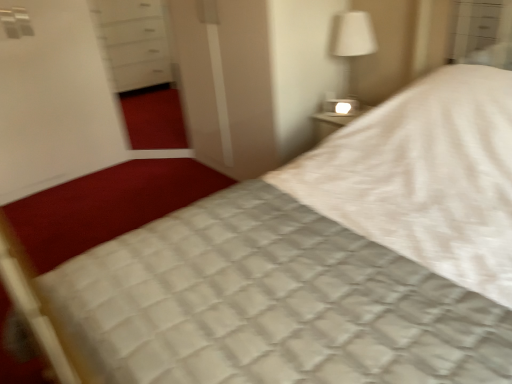
Image resolution: width=512 pixels, height=384 pixels. Describe the element at coordinates (226, 83) in the screenshot. I see `transparent glass screen door at center, which is the first screen door in right-to-left order` at that location.

I want to click on transparent glass screen door at center, which is the first screen door in right-to-left order, so click(x=226, y=83).

Considering the positions of objects white glossy screen door at upper left, the 1th screen door from the left, and transparent glass screen door at center, which is the first screen door in right-to-left order, in the image provided, who is behind, white glossy screen door at upper left, the 1th screen door from the left, or transparent glass screen door at center, which is the first screen door in right-to-left order,?

white glossy screen door at upper left, the 1th screen door from the left, is further from the camera.

From a real-world perspective, is white glossy screen door at upper left, the 1th screen door from the left, positioned over transparent glass screen door at center, which is the first screen door in right-to-left order, based on gravity?

Indeed, from a real-world perspective, white glossy screen door at upper left, the 1th screen door from the left, stands above transparent glass screen door at center, which is the first screen door in right-to-left order.

Can you confirm if white glossy screen door at upper left, marked as the 2th screen door in a right-to-left arrangement, is positioned to the left of transparent glass screen door at center, which is the first screen door in right-to-left order?

Indeed, white glossy screen door at upper left, marked as the 2th screen door in a right-to-left arrangement, is positioned on the left side of transparent glass screen door at center, which is the first screen door in right-to-left order.

This screenshot has width=512, height=384. In the image, there is a white glossy screen door at upper left, marked as the 2th screen door in a right-to-left arrangement. In order to click on screen door below it (from a real-world perspective) in this screenshot , I will do `click(226, 83)`.

Considering the points (72, 31) and (347, 52), which point is behind, point (72, 31) or point (347, 52)?

The point (72, 31) is farther from the camera.

Between white glossy screen door at upper left, marked as the 2th screen door in a right-to-left arrangement, and white fabric lampshade at upper right, which one has larger width?

With larger width is white glossy screen door at upper left, marked as the 2th screen door in a right-to-left arrangement.

From their relative heights in the image, would you say white glossy screen door at upper left, the 1th screen door from the left, is taller or shorter than white fabric lampshade at upper right?

Clearly, white glossy screen door at upper left, the 1th screen door from the left, is taller compared to white fabric lampshade at upper right.

In the scene shown: Between transparent glass screen door at center, the 2th screen door from the left, and white fabric lampshade at upper right, which one is positioned behind?

white fabric lampshade at upper right is further away from the camera.

Can you confirm if transparent glass screen door at center, which is the first screen door in right-to-left order, is taller than white fabric lampshade at upper right?

Indeed, transparent glass screen door at center, which is the first screen door in right-to-left order, has a greater height compared to white fabric lampshade at upper right.

Which object is positioned more to the left, transparent glass screen door at center, the 2th screen door from the left, or white fabric lampshade at upper right?

Positioned to the left is transparent glass screen door at center, the 2th screen door from the left.

Is point (263, 108) positioned after point (362, 41)?

Yes, point (263, 108) is farther from viewer.

From their relative heights in the image, would you say white fabric lampshade at upper right is taller or shorter than transparent glass screen door at center, which is the first screen door in right-to-left order?

Clearly, white fabric lampshade at upper right is shorter compared to transparent glass screen door at center, which is the first screen door in right-to-left order.

Which of these two, white fabric lampshade at upper right or transparent glass screen door at center, which is the first screen door in right-to-left order, is wider?

With larger width is transparent glass screen door at center, which is the first screen door in right-to-left order.

Is white fabric lampshade at upper right far away from transparent glass screen door at center, the 2th screen door from the left?

white fabric lampshade at upper right is near transparent glass screen door at center, the 2th screen door from the left, not far away.

From a real-world perspective, between transparent glass screen door at center, which is the first screen door in right-to-left order, and white glossy screen door at upper left, marked as the 2th screen door in a right-to-left arrangement, who is vertically higher?

white glossy screen door at upper left, marked as the 2th screen door in a right-to-left arrangement, is physically above.

From the picture: Which of these two, transparent glass screen door at center, the 2th screen door from the left, or white glossy screen door at upper left, the 1th screen door from the left, stands taller?

Standing taller between the two is white glossy screen door at upper left, the 1th screen door from the left.

Is transparent glass screen door at center, which is the first screen door in right-to-left order, in front of white glossy screen door at upper left, marked as the 2th screen door in a right-to-left arrangement?

Yes, transparent glass screen door at center, which is the first screen door in right-to-left order, is closer to the camera.

Considering the positions of objects transparent glass screen door at center, which is the first screen door in right-to-left order, and white glossy screen door at upper left, the 1th screen door from the left, in the image provided, who is more to the right, transparent glass screen door at center, which is the first screen door in right-to-left order, or white glossy screen door at upper left, the 1th screen door from the left,?

transparent glass screen door at center, which is the first screen door in right-to-left order, is more to the right.

Are white fabric lampshade at upper right and white glossy screen door at upper left, the 1th screen door from the left, making contact?

No, white fabric lampshade at upper right is not in contact with white glossy screen door at upper left, the 1th screen door from the left.

Looking at this image, how many degrees apart are the facing directions of white fabric lampshade at upper right and white glossy screen door at upper left, the 1th screen door from the left?

92.1 degrees.

Does white fabric lampshade at upper right have a larger size compared to white glossy screen door at upper left, marked as the 2th screen door in a right-to-left arrangement?

No.

Is white fabric lampshade at upper right looking in the opposite direction of white glossy screen door at upper left, marked as the 2th screen door in a right-to-left arrangement?

No, white fabric lampshade at upper right is not facing the opposite direction of white glossy screen door at upper left, marked as the 2th screen door in a right-to-left arrangement.

This screenshot has width=512, height=384. I want to click on screen door to the left of transparent glass screen door at center, the 2th screen door from the left, so click(55, 101).

Where is `bedside lamp located above the white glossy screen door at upper left, the 1th screen door from the left (from a real-world perspective)`? The width and height of the screenshot is (512, 384). bedside lamp located above the white glossy screen door at upper left, the 1th screen door from the left (from a real-world perspective) is located at coordinates (353, 42).

From the image, which object appears to be nearer to transparent glass screen door at center, which is the first screen door in right-to-left order, white fabric lampshade at upper right or white glossy screen door at upper left, marked as the 2th screen door in a right-to-left arrangement?

white fabric lampshade at upper right.

Looking at the image, which one is located closer to white fabric lampshade at upper right, white glossy screen door at upper left, the 1th screen door from the left, or transparent glass screen door at center, the 2th screen door from the left?

transparent glass screen door at center, the 2th screen door from the left, lies closer to white fabric lampshade at upper right than the other object.

Which object lies nearer to the anchor point white glossy screen door at upper left, the 1th screen door from the left, white fabric lampshade at upper right or transparent glass screen door at center, which is the first screen door in right-to-left order?

transparent glass screen door at center, which is the first screen door in right-to-left order, lies closer to white glossy screen door at upper left, the 1th screen door from the left, than the other object.

When comparing their distances from white glossy screen door at upper left, the 1th screen door from the left, does transparent glass screen door at center, the 2th screen door from the left, or white fabric lampshade at upper right seem closer?

transparent glass screen door at center, the 2th screen door from the left, is positioned closer to the anchor white glossy screen door at upper left, the 1th screen door from the left.

From the image, which object appears to be farther from white fabric lampshade at upper right, transparent glass screen door at center, the 2th screen door from the left, or white glossy screen door at upper left, marked as the 2th screen door in a right-to-left arrangement?

white glossy screen door at upper left, marked as the 2th screen door in a right-to-left arrangement, lies further to white fabric lampshade at upper right than the other object.

Considering their positions, is white glossy screen door at upper left, marked as the 2th screen door in a right-to-left arrangement, positioned further to transparent glass screen door at center, which is the first screen door in right-to-left order, than white fabric lampshade at upper right?

Among the two, white glossy screen door at upper left, marked as the 2th screen door in a right-to-left arrangement, is located further to transparent glass screen door at center, which is the first screen door in right-to-left order.

Find the location of a particular element. Image resolution: width=512 pixels, height=384 pixels. screen door between white glossy screen door at upper left, marked as the 2th screen door in a right-to-left arrangement, and white fabric lampshade at upper right is located at coordinates (226, 83).